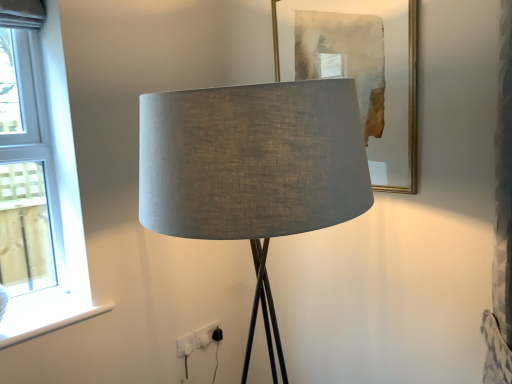
Where is `white plastic electric outlet at lower center, the second electric outlet from the back`? white plastic electric outlet at lower center, the second electric outlet from the back is located at coordinates (186, 345).

Identify the location of white plastic electric outlet at lower center, the 2th electric outlet positioned from the left. (205, 334).

Describe the element at coordinates (253, 169) in the screenshot. I see `matte gray fabric lamp at center` at that location.

This screenshot has height=384, width=512. I want to click on clear glass window at left, so point(40,193).

Image resolution: width=512 pixels, height=384 pixels. Describe the element at coordinates (364, 72) in the screenshot. I see `gold-framed mirror at upper center` at that location.

Locate an element on the screen. The width and height of the screenshot is (512, 384). white plastic electric outlet at lower center, which is counted as the first electric outlet, starting from the left is located at coordinates (186, 345).

From the picture: Does white plastic electric outlet at lower center, the second electric outlet from the back, have a greater height compared to gold-framed mirror at upper center?

Incorrect, the height of white plastic electric outlet at lower center, the second electric outlet from the back, is not larger of that of gold-framed mirror at upper center.

Locate an element on the screen. the 2nd electric outlet to the left of the gold-framed mirror at upper center, starting your count from the anchor is located at coordinates (186, 345).

Is white plastic electric outlet at lower center, acting as the 1th electric outlet starting from the front, completely or partially outside of gold-framed mirror at upper center?

That's correct, white plastic electric outlet at lower center, acting as the 1th electric outlet starting from the front, is outside of gold-framed mirror at upper center.

Considering the sizes of white plastic electric outlet at lower center, acting as the 1th electric outlet starting from the front, and white plastic electric outlet at lower center, the 2th electric outlet positioned from the left, in the image, is white plastic electric outlet at lower center, acting as the 1th electric outlet starting from the front, taller or shorter than white plastic electric outlet at lower center, the 2th electric outlet positioned from the left,?

Clearly, white plastic electric outlet at lower center, acting as the 1th electric outlet starting from the front, is shorter compared to white plastic electric outlet at lower center, the 2th electric outlet positioned from the left.

Can you see white plastic electric outlet at lower center, which is counted as the first electric outlet, starting from the left, touching white plastic electric outlet at lower center, acting as the 2th electric outlet starting from the front?

Yes, white plastic electric outlet at lower center, which is counted as the first electric outlet, starting from the left, is touching white plastic electric outlet at lower center, acting as the 2th electric outlet starting from the front.

Can you confirm if white plastic electric outlet at lower center, the second electric outlet from the back, is bigger than white plastic electric outlet at lower center, the 1th electric outlet in the back-to-front sequence?

Incorrect, white plastic electric outlet at lower center, the second electric outlet from the back, is not larger than white plastic electric outlet at lower center, the 1th electric outlet in the back-to-front sequence.

Between white plastic electric outlet at lower center, acting as the 1th electric outlet starting from the front, and white plastic electric outlet at lower center, the 1th electric outlet in the back-to-front sequence, which one is positioned in front?

Positioned in front is white plastic electric outlet at lower center, acting as the 1th electric outlet starting from the front.

Can you tell me how much clear glass window at left and white smooth window sill at lower left differ in facing direction?

The angle between the facing direction of clear glass window at left and the facing direction of white smooth window sill at lower left is 4.62e-05 degrees.

From the image's perspective, which is above, clear glass window at left or white smooth window sill at lower left?

From the image's view, clear glass window at left is above.

Are clear glass window at left and white smooth window sill at lower left far apart?

No, clear glass window at left is not far away from white smooth window sill at lower left.

Which is behind, point (1, 240) or point (8, 346)?

The point (1, 240) is farther.

Looking at their sizes, would you say white plastic electric outlet at lower center, acting as the 1th electric outlet starting from the front, is wider or thinner than white smooth window sill at lower left?

Considering their sizes, white plastic electric outlet at lower center, acting as the 1th electric outlet starting from the front, looks slimmer than white smooth window sill at lower left.

Can you tell me how much white plastic electric outlet at lower center, which is counted as the first electric outlet, starting from the left, and white smooth window sill at lower left differ in facing direction?

The angular difference between white plastic electric outlet at lower center, which is counted as the first electric outlet, starting from the left, and white smooth window sill at lower left is 1.91 degrees.

Is white plastic electric outlet at lower center, which is counted as the first electric outlet, starting from the left, bigger or smaller than white smooth window sill at lower left?

white plastic electric outlet at lower center, which is counted as the first electric outlet, starting from the left, is smaller than white smooth window sill at lower left.

Between white plastic electric outlet at lower center, which ranks as the 2th electric outlet in right-to-left order, and white smooth window sill at lower left, which one has less height?

With less height is white smooth window sill at lower left.

In terms of width, does white smooth window sill at lower left look wider or thinner when compared to white plastic electric outlet at lower center, acting as the 1th electric outlet starting from the front?

white smooth window sill at lower left is wider than white plastic electric outlet at lower center, acting as the 1th electric outlet starting from the front.

Does white smooth window sill at lower left turn towards white plastic electric outlet at lower center, acting as the 1th electric outlet starting from the front?

No, white smooth window sill at lower left is not oriented towards white plastic electric outlet at lower center, acting as the 1th electric outlet starting from the front.

Which is in front, point (89, 310) or point (185, 351)?

Point (89, 310)

Is gold-framed mirror at upper center far from matte gray fabric lamp at center?

gold-framed mirror at upper center is actually quite close to matte gray fabric lamp at center.

Is gold-framed mirror at upper center to the left of matte gray fabric lamp at center from the viewer's perspective?

No.

Is gold-framed mirror at upper center bigger or smaller than matte gray fabric lamp at center?

gold-framed mirror at upper center is smaller than matte gray fabric lamp at center.

Which of these two, gold-framed mirror at upper center or matte gray fabric lamp at center, is wider?

With larger width is matte gray fabric lamp at center.

Does white plastic electric outlet at lower center, acting as the 2th electric outlet starting from the front, have a larger size compared to gold-framed mirror at upper center?

No, white plastic electric outlet at lower center, acting as the 2th electric outlet starting from the front, is not bigger than gold-framed mirror at upper center.

Where is `picture frame that is above the white plastic electric outlet at lower center, acting as the 2th electric outlet starting from the front (from the image's perspective)`? The width and height of the screenshot is (512, 384). picture frame that is above the white plastic electric outlet at lower center, acting as the 2th electric outlet starting from the front (from the image's perspective) is located at coordinates (364, 72).

Is white plastic electric outlet at lower center, the 1th electric outlet in the back-to-front sequence, to the left of gold-framed mirror at upper center from the viewer's perspective?

Yes.

Which point is more forward, (202, 338) or (374, 89)?

Point (374, 89)

The image size is (512, 384). Identify the location of picture frame above the white plastic electric outlet at lower center, which ranks as the 2th electric outlet in right-to-left order (from a real-world perspective). (364, 72).

Locate an element on the screen. This screenshot has height=384, width=512. electric outlet lying on the left of white plastic electric outlet at lower center, the 2th electric outlet positioned from the left is located at coordinates (186, 345).

From the image, which object appears to be farther from white smooth window sill at lower left, white plastic electric outlet at lower center, the 1th electric outlet in the back-to-front sequence, or gold-framed mirror at upper center?

Among the two, gold-framed mirror at upper center is located further to white smooth window sill at lower left.

From the image, which object appears to be farther from white plastic electric outlet at lower center, which is counted as the first electric outlet, starting from the left, white plastic electric outlet at lower center, acting as the 2th electric outlet starting from the front, or matte gray fabric lamp at center?

Based on the image, matte gray fabric lamp at center appears to be further to white plastic electric outlet at lower center, which is counted as the first electric outlet, starting from the left.

Estimate the real-world distances between objects in this image. Which object is further from white plastic electric outlet at lower center, the second electric outlet from the back, white plastic electric outlet at lower center, the 2th electric outlet positioned from the left, or gold-framed mirror at upper center?

Based on the image, gold-framed mirror at upper center appears to be further to white plastic electric outlet at lower center, the second electric outlet from the back.

When comparing their distances from matte gray fabric lamp at center, does white plastic electric outlet at lower center, the 2th electric outlet positioned from the left, or gold-framed mirror at upper center seem closer?

gold-framed mirror at upper center.

Based on their spatial positions, is gold-framed mirror at upper center or white plastic electric outlet at lower center, acting as the 2th electric outlet starting from the front, further from clear glass window at left?

Based on the image, gold-framed mirror at upper center appears to be further to clear glass window at left.

When comparing their distances from white plastic electric outlet at lower center, the first electric outlet when ordered from right to left, does gold-framed mirror at upper center or matte gray fabric lamp at center seem further?

matte gray fabric lamp at center lies further to white plastic electric outlet at lower center, the first electric outlet when ordered from right to left, than the other object.

From the image, which object appears to be farther from clear glass window at left, white plastic electric outlet at lower center, the first electric outlet when ordered from right to left, or matte gray fabric lamp at center?

matte gray fabric lamp at center is further to clear glass window at left.

Estimate the real-world distances between objects in this image. Which object is closer to gold-framed mirror at upper center, matte gray fabric lamp at center or white plastic electric outlet at lower center, which is counted as the first electric outlet, starting from the left?

matte gray fabric lamp at center is positioned closer to the anchor gold-framed mirror at upper center.

Identify the location of window sill between clear glass window at left and matte gray fabric lamp at center in the horizontal direction. The height and width of the screenshot is (384, 512). (53, 326).

Where is `lamp between clear glass window at left and gold-framed mirror at upper center in the horizontal direction`? The height and width of the screenshot is (384, 512). lamp between clear glass window at left and gold-framed mirror at upper center in the horizontal direction is located at coordinates (253, 169).

Where is `window sill located between matte gray fabric lamp at center and white plastic electric outlet at lower center, the 2th electric outlet positioned from the left, in the depth direction`? The width and height of the screenshot is (512, 384). window sill located between matte gray fabric lamp at center and white plastic electric outlet at lower center, the 2th electric outlet positioned from the left, in the depth direction is located at coordinates (53, 326).

Locate an element on the screen. window sill between clear glass window at left and white plastic electric outlet at lower center, the second electric outlet from the back, vertically is located at coordinates (53, 326).